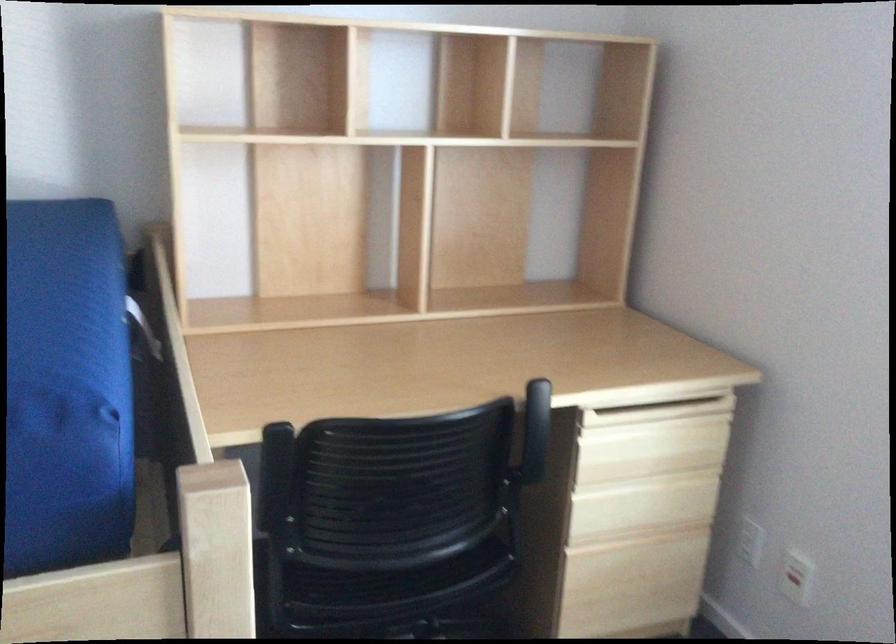
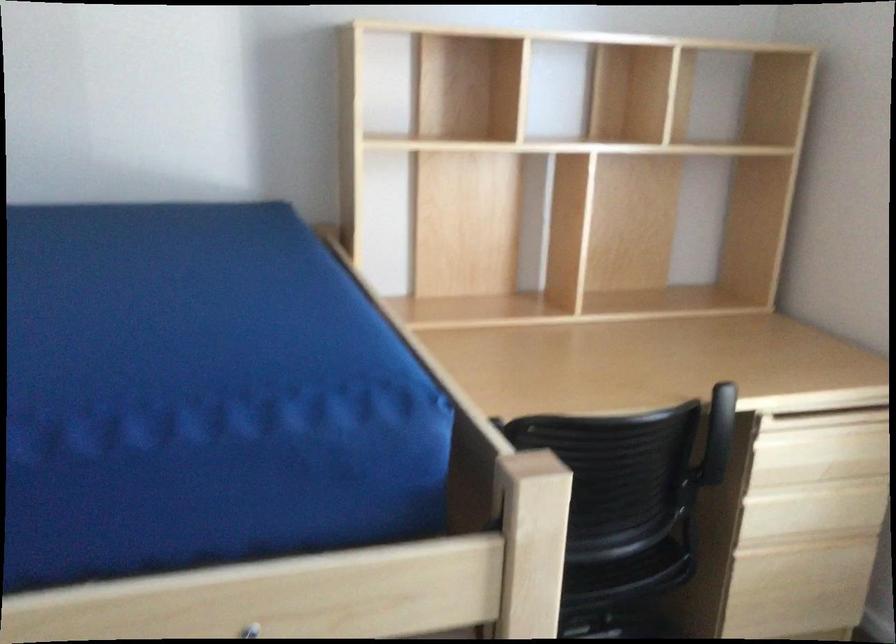
Where in the second image is the point corresponding to point (647, 444) from the first image?

(819, 450)